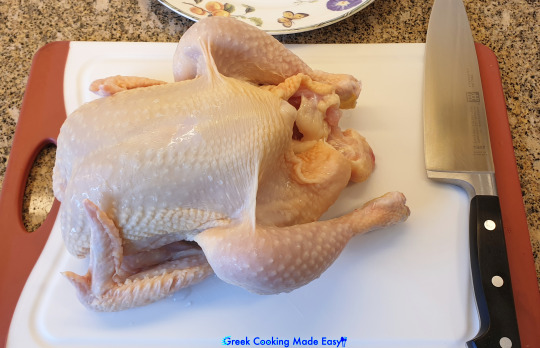
In order to click on purple flowers on dish in this screenshot , I will do `click(342, 5)`.